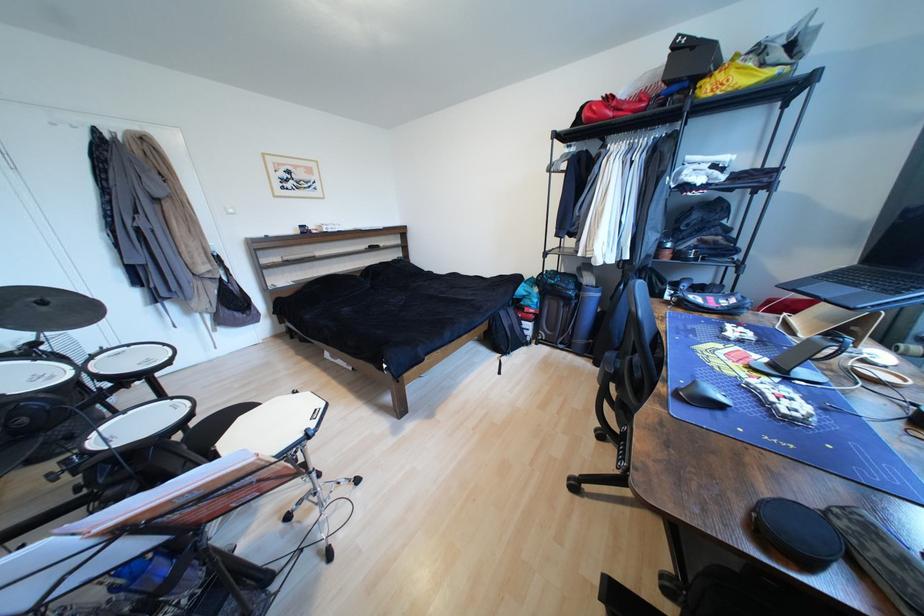
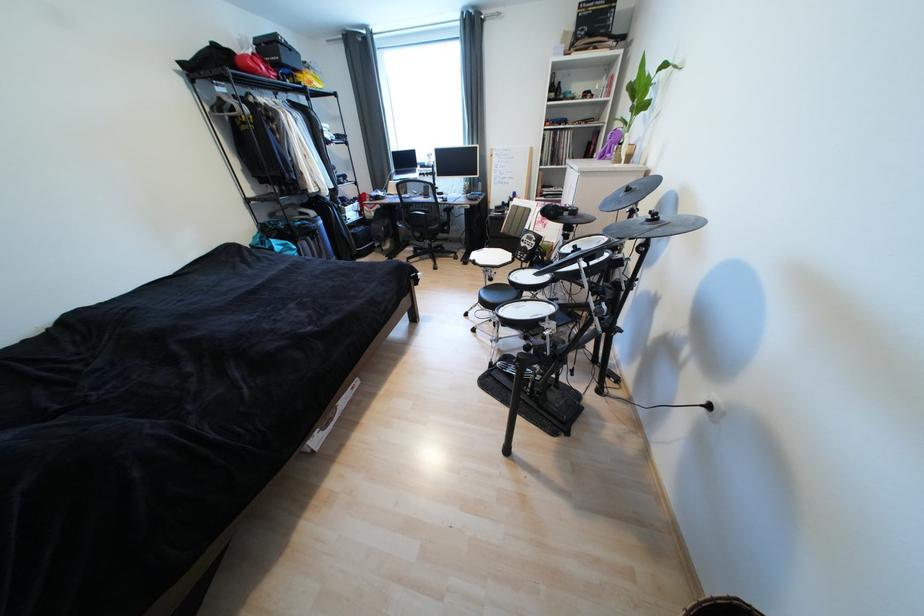
In the second image, find the point that corresponds to [686,81] in the first image.

(294, 68)